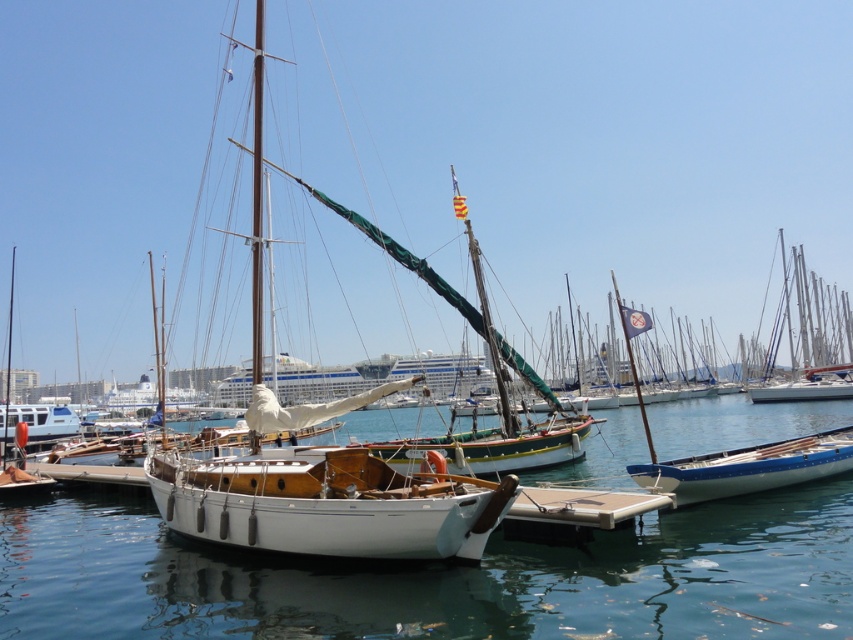
Is white glossy boat at lower right further to camera compared to white plastic boat at lower left?

No, it is not.

Which is below, white glossy boat at lower right or white plastic boat at lower left?

Positioned lower is white plastic boat at lower left.

Is point (825, 444) farther from viewer compared to point (48, 419)?

No, (825, 444) is closer to viewer.

Locate an element on the screen. The width and height of the screenshot is (853, 640). white glossy boat at lower right is located at coordinates (747, 467).

Who is taller, clear blue water at center or white plastic boat at lower left?

With more height is white plastic boat at lower left.

How far apart are clear blue water at center and white plastic boat at lower left?

25.15 meters

Between point (408, 630) and point (65, 406), which one is positioned behind?

The point (65, 406) is more distant.

Locate an element on the screen. clear blue water at center is located at coordinates (437, 577).

What do you see at coordinates (437, 577) in the screenshot? This screenshot has width=853, height=640. I see `clear blue water at center` at bounding box center [437, 577].

Is point (154, 584) in front of point (767, 474)?

Yes, point (154, 584) is in front of point (767, 474).

Identify the location of clear blue water at center. (437, 577).

Where is `clear blue water at center`? This screenshot has width=853, height=640. clear blue water at center is located at coordinates (437, 577).